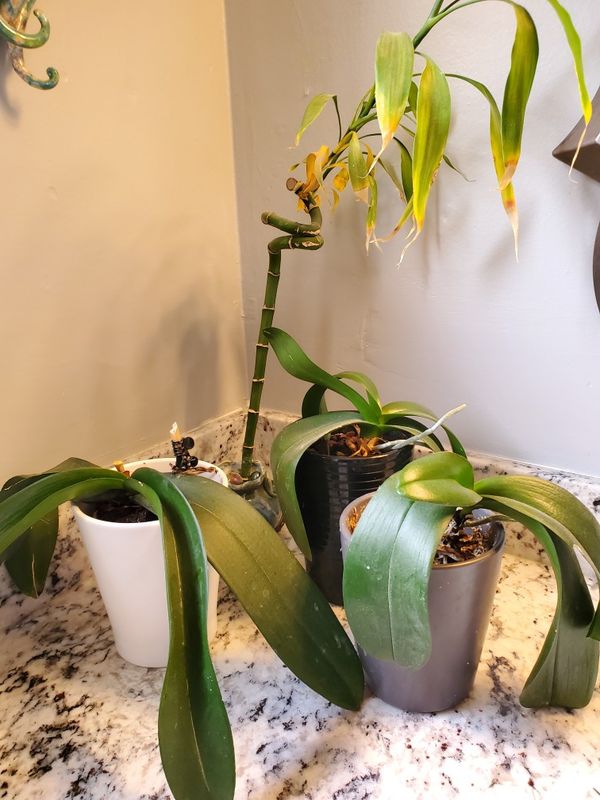
I want to click on marble countertop, so click(333, 754).